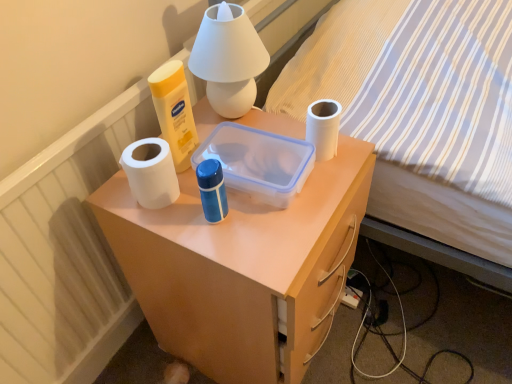
Locate an element on the screen. The height and width of the screenshot is (384, 512). unoccupied region to the right of white matte paper towel at left is located at coordinates (257, 210).